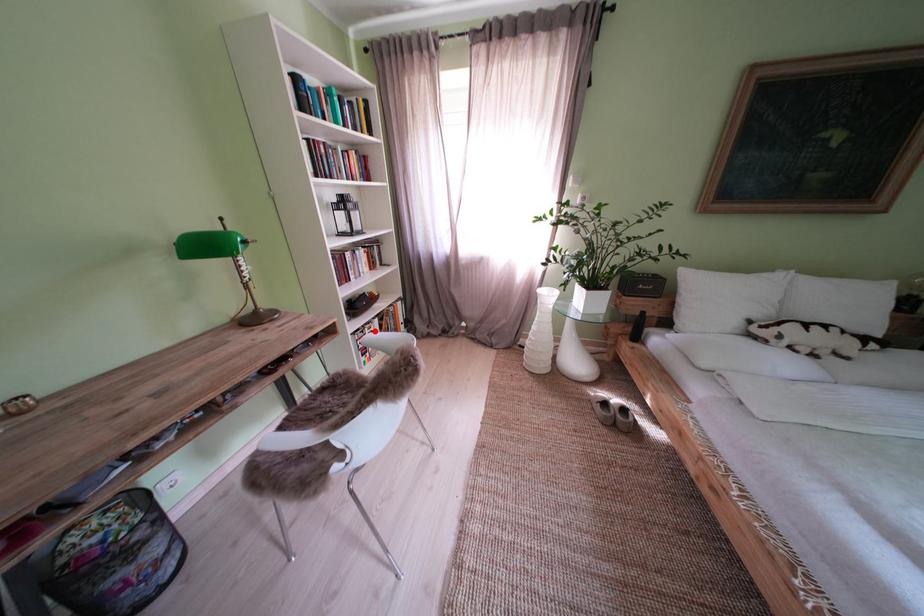
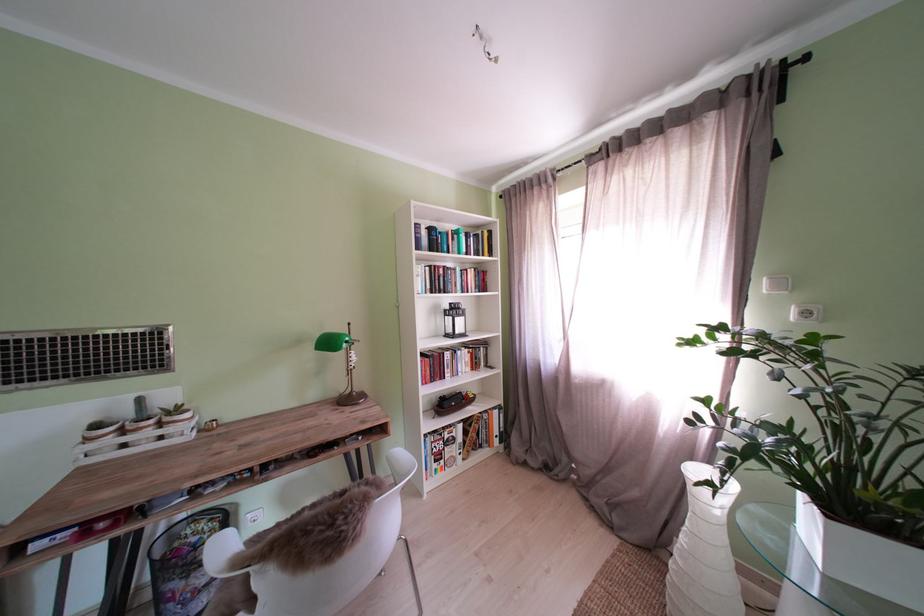
Question: I am providing you with two images of the same scene from different viewpoints. In image1, a red point is highlighted. Considering the same 3D point in image2, which of the following is correct?

Choices:
 (A) It is closer
 (B) It is farther

Answer: (B)